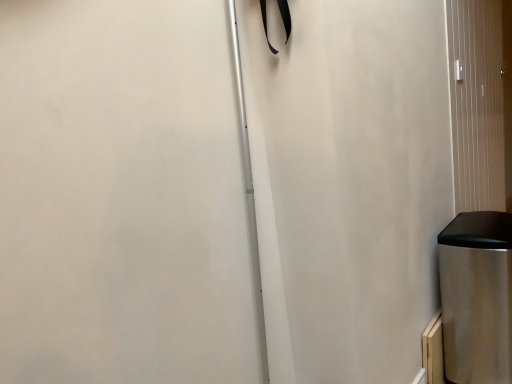
Question: Is metallic silver screen door at right directly adjacent to stainless steel trash can at lower right?

Choices:
 (A) yes
 (B) no

Answer: (B)

Question: From a real-world perspective, is metallic silver screen door at right on stainless steel trash can at lower right?

Choices:
 (A) yes
 (B) no

Answer: (A)

Question: Can you confirm if metallic silver screen door at right is wider than stainless steel trash can at lower right?

Choices:
 (A) yes
 (B) no

Answer: (B)

Question: From the image's perspective, is metallic silver screen door at right beneath stainless steel trash can at lower right?

Choices:
 (A) yes
 (B) no

Answer: (B)

Question: Is metallic silver screen door at right shorter than stainless steel trash can at lower right?

Choices:
 (A) yes
 (B) no

Answer: (B)

Question: Is metallic silver screen door at right smaller than stainless steel trash can at lower right?

Choices:
 (A) yes
 (B) no

Answer: (B)

Question: Is stainless steel trash can at lower right with metallic silver screen door at right?

Choices:
 (A) no
 (B) yes

Answer: (A)

Question: Does stainless steel trash can at lower right have a larger size compared to metallic silver screen door at right?

Choices:
 (A) no
 (B) yes

Answer: (A)

Question: Would you say stainless steel trash can at lower right is a long distance from metallic silver screen door at right?

Choices:
 (A) no
 (B) yes

Answer: (A)

Question: From a real-world perspective, is stainless steel trash can at lower right below metallic silver screen door at right?

Choices:
 (A) no
 (B) yes

Answer: (B)

Question: Is stainless steel trash can at lower right not inside metallic silver screen door at right?

Choices:
 (A) yes
 (B) no

Answer: (A)

Question: Is stainless steel trash can at lower right oriented away from metallic silver screen door at right?

Choices:
 (A) no
 (B) yes

Answer: (A)

Question: Would you say stainless steel trash can at lower right is inside or outside metallic silver screen door at right?

Choices:
 (A) outside
 (B) inside

Answer: (A)